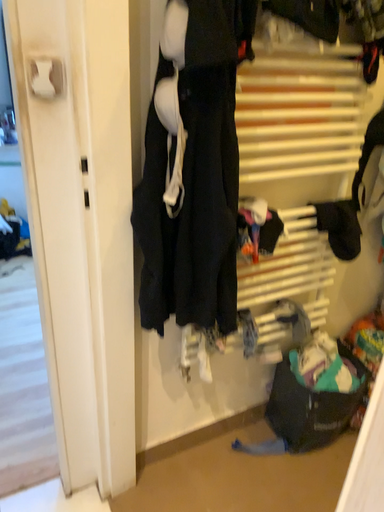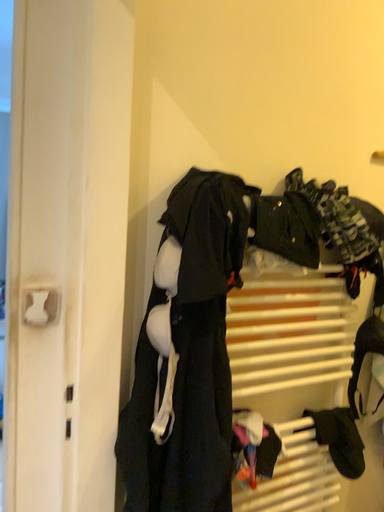
Question: How did the camera likely rotate when shooting the video?

Choices:
 (A) rotated downward
 (B) rotated upward

Answer: (B)